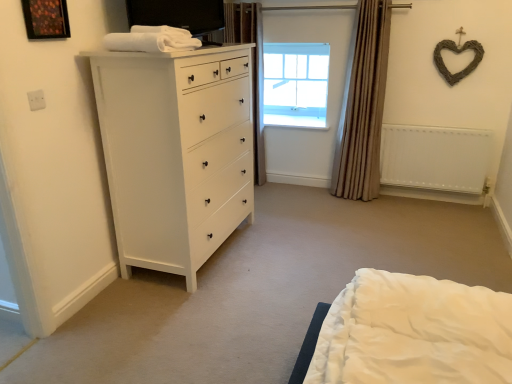
Find the location of a particular element. vacant space to the right of white matte chest of drawers at left is located at coordinates (289, 238).